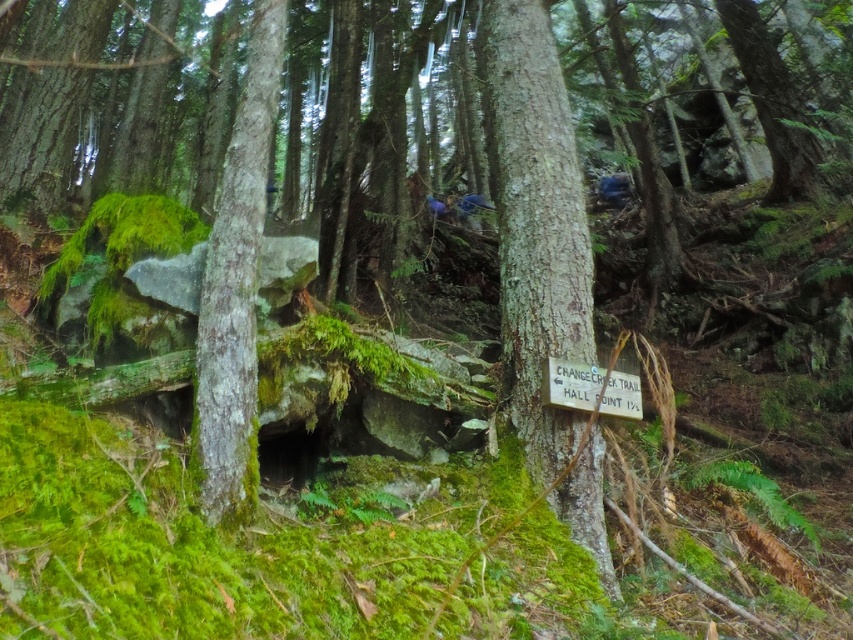
Where is `smooth bark tree trunk at center`? The height and width of the screenshot is (640, 853). smooth bark tree trunk at center is located at coordinates (538, 228).

Between smooth bark tree trunk at center and green mossy bark at center, which one is positioned higher?

smooth bark tree trunk at center is above.

Does point (590, 552) come closer to viewer compared to point (239, 307)?

No, it is not.

The height and width of the screenshot is (640, 853). Identify the location of smooth bark tree trunk at center. click(x=538, y=228).